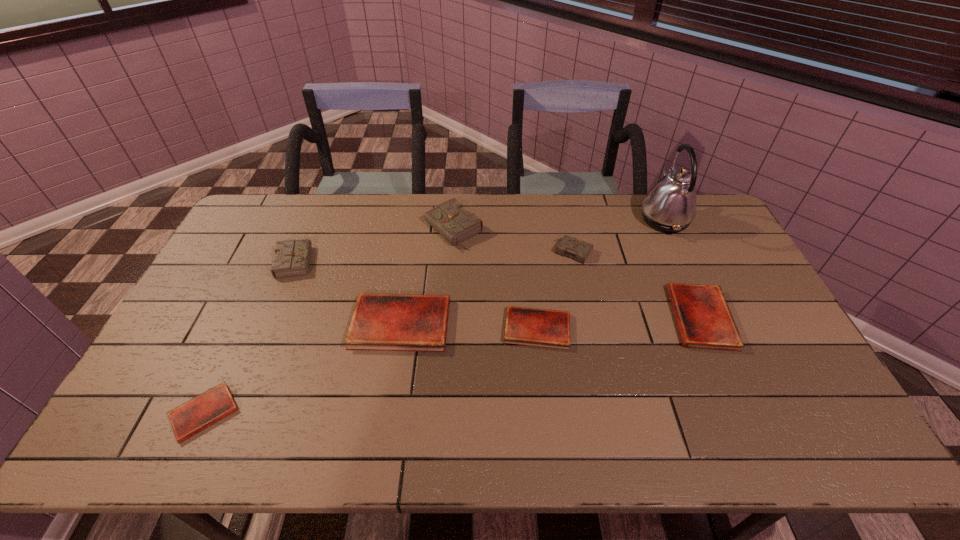
This screenshot has width=960, height=540. What are the coordinates of `diary that is at the right edge` in the screenshot? It's located at (704, 320).

Find the location of a particular element. Image resolution: width=960 pixels, height=540 pixels. object that is at the near left corner is located at coordinates (204, 410).

This screenshot has height=540, width=960. Identify the location of object situated at the far right corner. (670, 206).

Identify the location of vacant space at the far edge. (301, 198).

You are a GUI agent. You are given a task and a screenshot of the screen. Output one action in this format:
    pyautogui.click(x=<x>, y=<y>)
    Task: Click on the vacant space at the near edge of the desktop
    The height and width of the screenshot is (540, 960).
    Given the screenshot: What is the action you would take?
    pyautogui.click(x=607, y=428)

In order to click on vacant space at the left edge in this screenshot , I will do `click(180, 366)`.

I want to click on vacant space at the right edge of the desktop, so click(774, 334).

This screenshot has height=540, width=960. I want to click on free region at the far left corner of the desktop, so click(257, 222).

Image resolution: width=960 pixels, height=540 pixels. What are the coordinates of `free space at the near left corner of the desktop` in the screenshot? It's located at (108, 454).

Locate an element on the screen. free spot at the far right corner of the desktop is located at coordinates (699, 227).